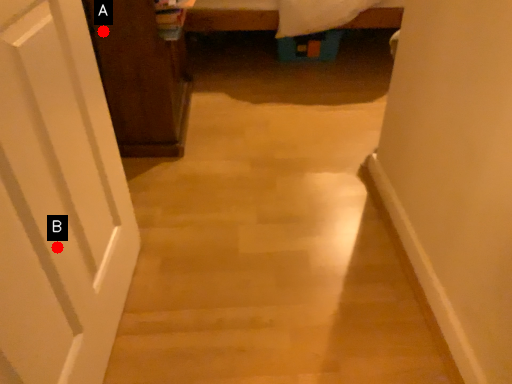
Question: Two points are circled on the image, labeled by A and B beside each circle. Which point is farther to the camera?

Choices:
 (A) A is further
 (B) B is further

Answer: (A)